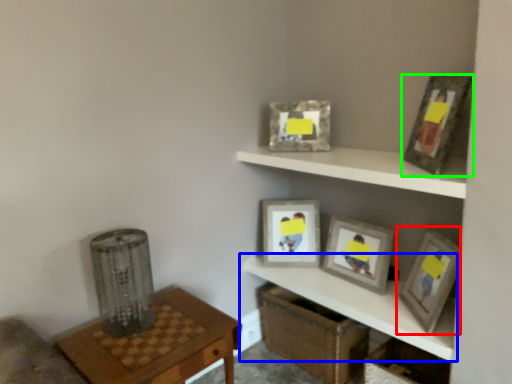
Question: Which object is the farthest from picture frame (highlighted by a red box)? Choose among these: shelf (highlighted by a blue box) or picture frame (highlighted by a green box).

Choices:
 (A) shelf
 (B) picture frame

Answer: (B)